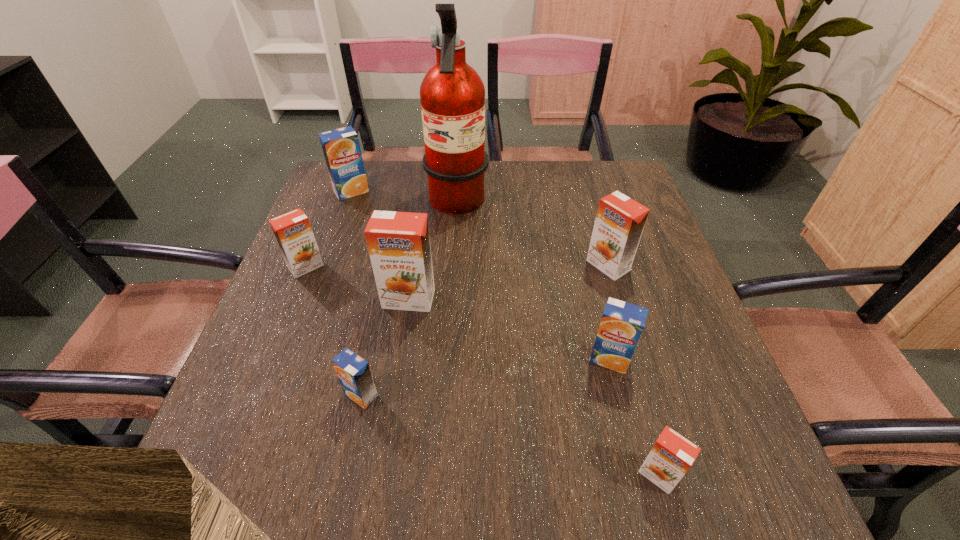
Where is `vacant space located on the back of the nearest object`? The height and width of the screenshot is (540, 960). vacant space located on the back of the nearest object is located at coordinates (640, 412).

The height and width of the screenshot is (540, 960). In order to click on fire extinguisher located at the far edge in this screenshot , I will do `click(452, 94)`.

This screenshot has width=960, height=540. What are the coordinates of `orange_juice that is at the far edge` in the screenshot? It's located at (341, 148).

Locate an element on the screen. Image resolution: width=960 pixels, height=540 pixels. object that is at the near edge is located at coordinates (671, 457).

Identify the location of object located at the far left corner. This screenshot has width=960, height=540. (341, 148).

Identify the location of object that is at the near right corner. (671, 457).

Image resolution: width=960 pixels, height=540 pixels. Find the location of `vacant area at the far edge of the desktop`. vacant area at the far edge of the desktop is located at coordinates (506, 165).

Locate an element on the screen. This screenshot has height=540, width=960. vacant position at the near edge of the desktop is located at coordinates (345, 471).

The width and height of the screenshot is (960, 540). In the image, there is a desktop. In order to click on vacant space at the left edge in this screenshot , I will do `click(320, 282)`.

In the image, there is a desktop. At what (x,y) coordinates should I click in order to perform the action: click on free space at the right edge. Please return your answer as a coordinate pair (x, y). This screenshot has width=960, height=540. Looking at the image, I should click on (666, 253).